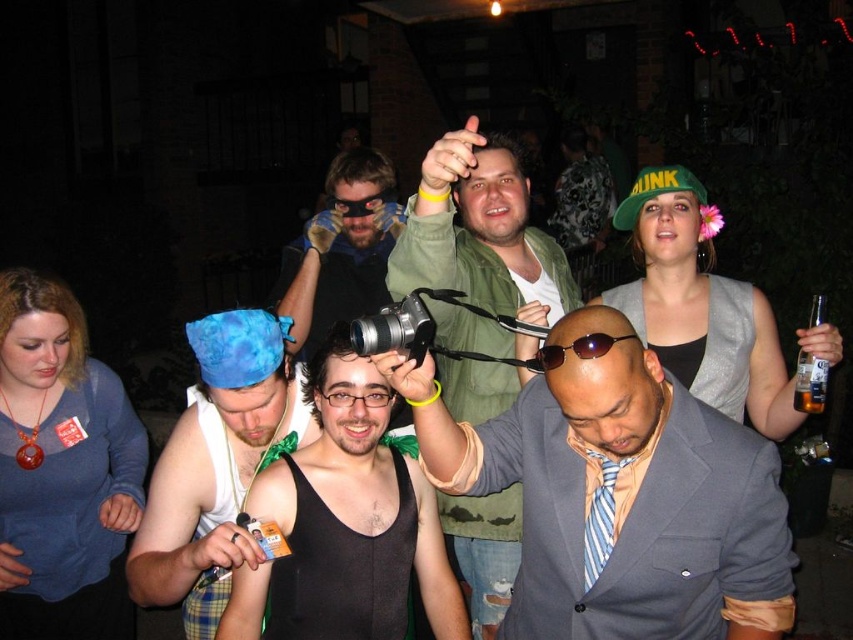
You are part of the group in the image and want to take a photo using the matte black camera at center. However, there are black rubber goggles at center in the way. Can you move the camera closer to yourself without moving the goggles?

The matte black camera at center is already in front of the black rubber goggles at center, so you can move the camera closer to yourself without moving the goggles since it is already positioned in front.

You are standing in the crowd at the nighttime gathering and want to find the black matte tank top at center. According to the coordinates provided, where should you look to locate it?

The black matte tank top at center is located at coordinates point (341, 570).